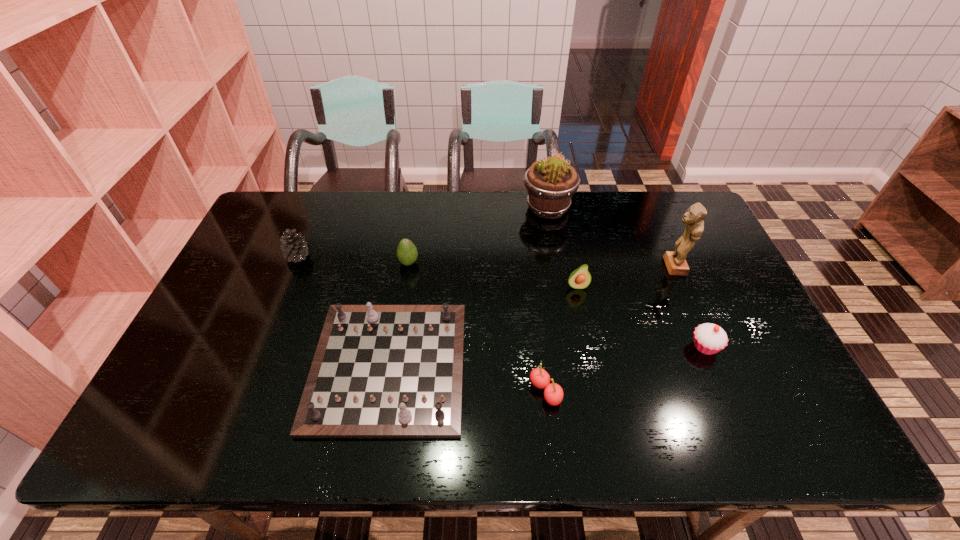
Locate an element on the screen. the farthest object is located at coordinates (551, 183).

The image size is (960, 540). I want to click on figurine, so click(x=676, y=264).

Find the location of a particular element. The height and width of the screenshot is (540, 960). pinecone is located at coordinates (294, 246).

The height and width of the screenshot is (540, 960). In order to click on the nearer avocado in this screenshot , I will do `click(580, 278)`.

Identify the location of the right avocado. (580, 278).

At what (x,y) coordinates should I click in order to perform the action: click on the farther avocado. Please return your answer as a coordinate pair (x, y). The height and width of the screenshot is (540, 960). Looking at the image, I should click on (407, 253).

You are a GUI agent. You are given a task and a screenshot of the screen. Output one action in this format:
    pyautogui.click(x=<x>, y=<y>)
    Task: Click on the cupcake
    
    Given the screenshot: What is the action you would take?
    pyautogui.click(x=709, y=338)

Identify the location of cherry. (553, 393).

Find the location of a particular element. The height and width of the screenshot is (540, 960). chessboard is located at coordinates (379, 371).

This screenshot has width=960, height=540. In order to click on vacant space located 0.350m on the front of the flowerpot in this screenshot , I will do `click(564, 304)`.